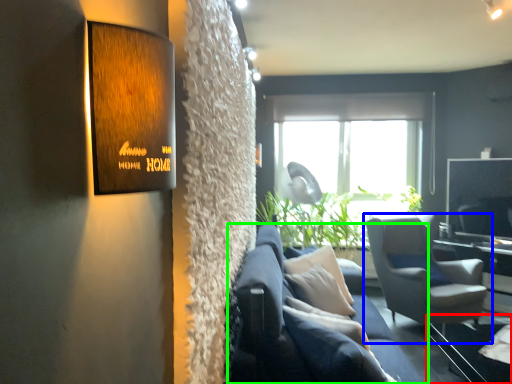
Question: Which is nearer to the glass table (highlighted by a red box)? chair (highlighted by a blue box) or studio couch (highlighted by a green box).

Choices:
 (A) chair
 (B) studio couch

Answer: (A)